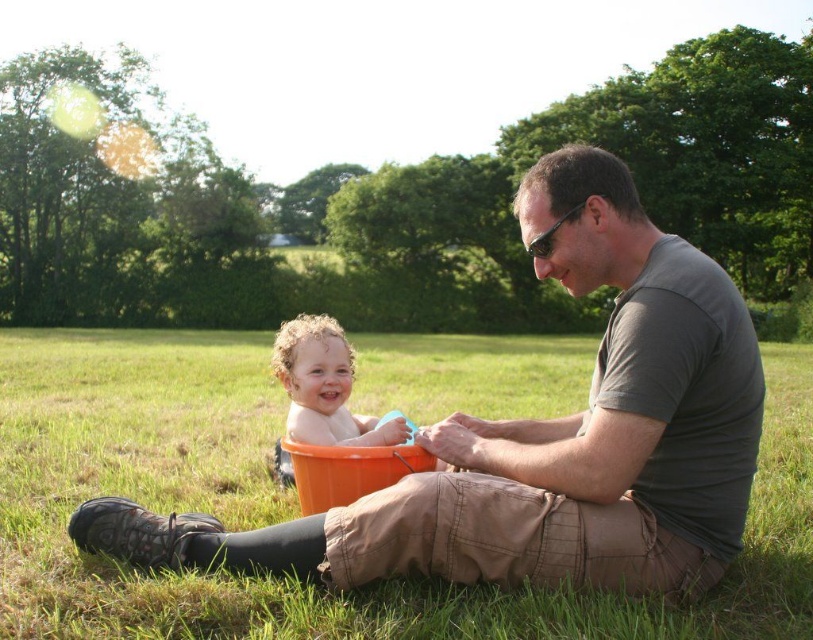
Can you confirm if green grass at center is positioned to the right of curly blonde hair at center?

Correct, you'll find green grass at center to the right of curly blonde hair at center.

Which is above, green grass at center or curly blonde hair at center?

green grass at center is above.

What do you see at coordinates (298, 506) in the screenshot? I see `green grass at center` at bounding box center [298, 506].

In order to click on green grass at center in this screenshot , I will do `click(298, 506)`.